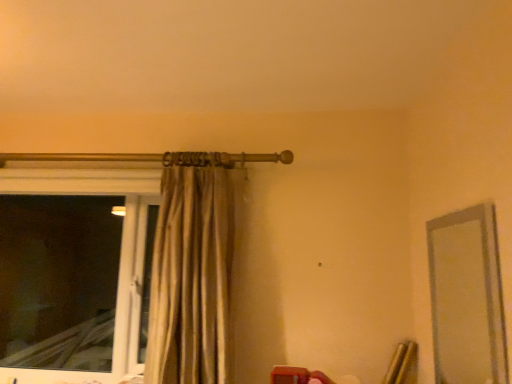
Question: From the image's perspective, is beige fabric curtain at upper center located above or below transparent glass window at left?

Choices:
 (A) above
 (B) below

Answer: (A)

Question: Is beige fabric curtain at upper center inside the boundaries of transparent glass window at left, or outside?

Choices:
 (A) inside
 (B) outside

Answer: (B)

Question: Estimate the real-world distances between objects in this image. Which object is farther from the transparent glass window at left?

Choices:
 (A) beige fabric curtain at upper center
 (B) clear glass mirror at right

Answer: (B)

Question: Estimate the real-world distances between objects in this image. Which object is farther from the transparent glass window at left?

Choices:
 (A) clear glass mirror at right
 (B) beige fabric curtain at upper center

Answer: (A)